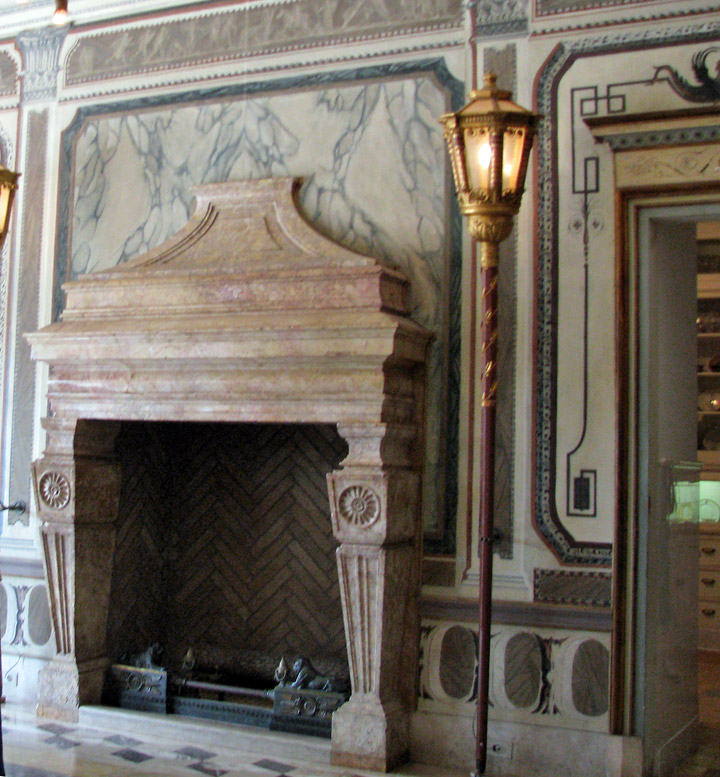
Find the location of `door`. door is located at coordinates (664, 294).